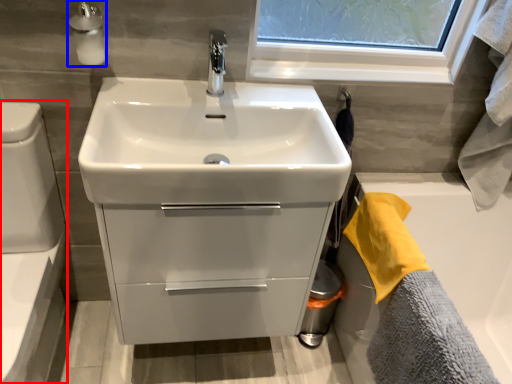
Question: Which of the following is the closest to the observer, toilet bowl (highlighted by a red box) or soap dispenser (highlighted by a blue box)?

Choices:
 (A) toilet bowl
 (B) soap dispenser

Answer: (A)